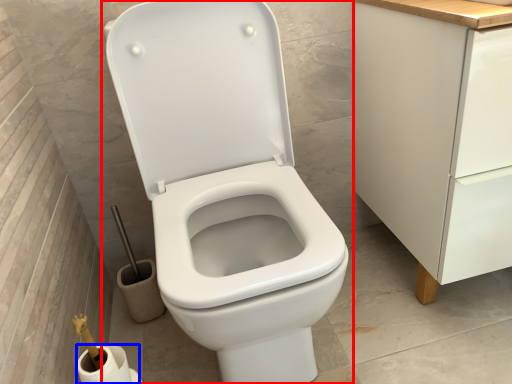
Question: Which of the following is the closest to the observer, toilet (highlighted by a red box) or toilet paper (highlighted by a blue box)?

Choices:
 (A) toilet
 (B) toilet paper

Answer: (A)